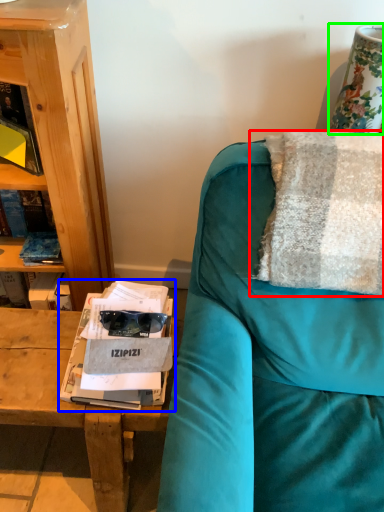
Question: Which object is the closest to the pillow (highlighted by a red box)? Choose among these: magazine (highlighted by a blue box) or table lamp (highlighted by a green box).

Choices:
 (A) magazine
 (B) table lamp

Answer: (B)